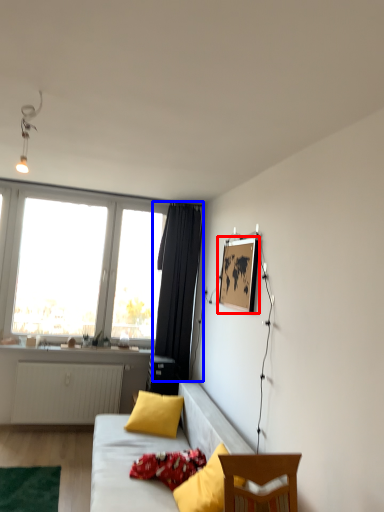
Question: Which point is closer to the camera, picture frame (highlighted by a red box) or curtain (highlighted by a blue box)?

Choices:
 (A) picture frame
 (B) curtain

Answer: (A)